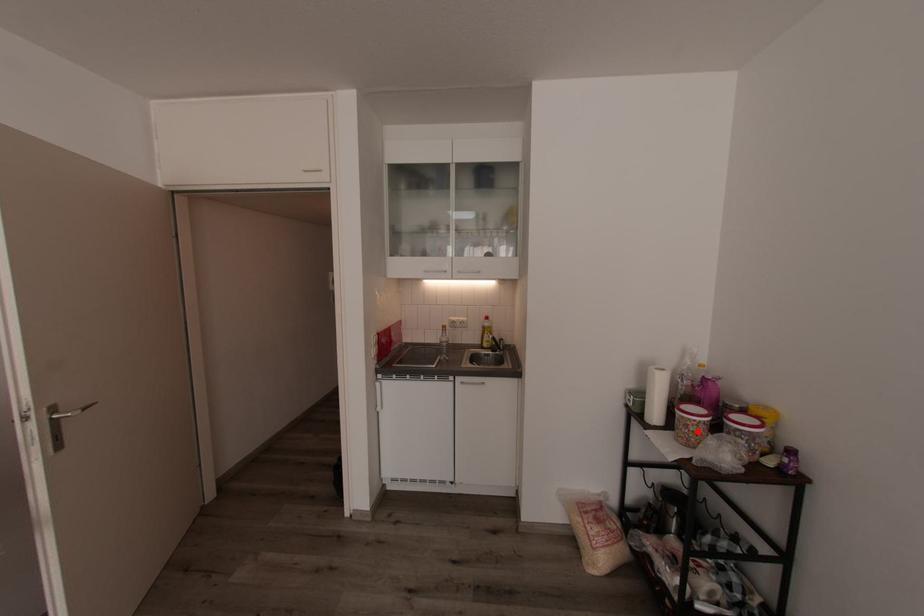
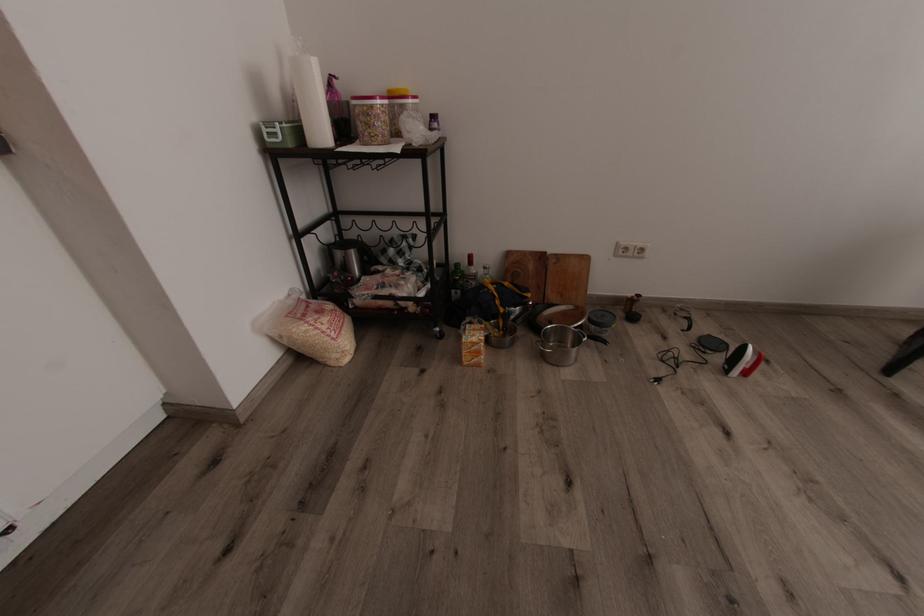
In the second image, find the point that corresponds to the highlighted location in the first image.

(388, 121)